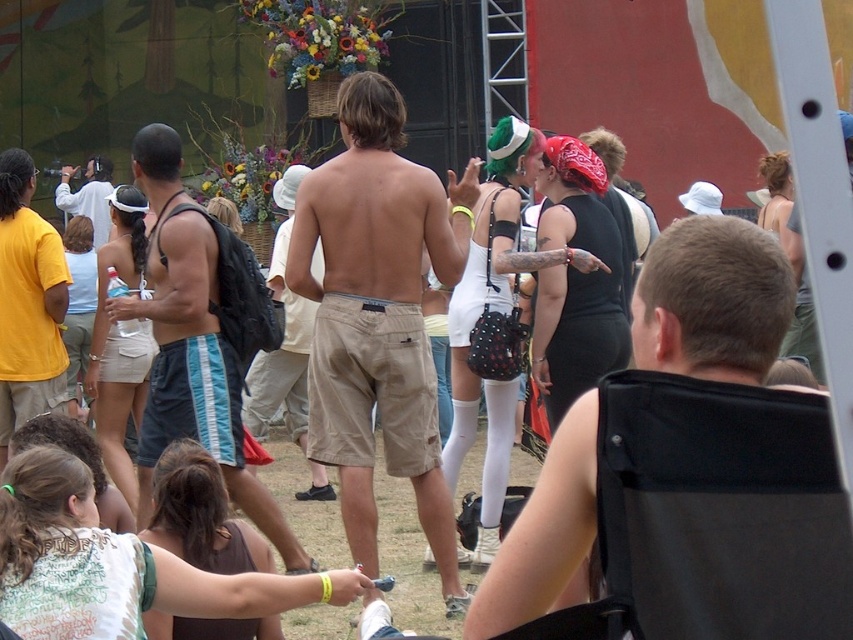
Question: In this image, where is tan cotton shorts at center located relative to blue striped shorts at center?

Choices:
 (A) above
 (B) below

Answer: (A)

Question: Which object is closer to the camera taking this photo?

Choices:
 (A) tan cotton shorts at center
 (B) light brown fabric shorts at center
 (C) yellow cotton t-shirt at left

Answer: (B)

Question: Among these points, which one is farthest from the camera?

Choices:
 (A) (329, 310)
 (B) (193, 221)
 (C) (675, 340)

Answer: (B)

Question: Is blue striped shorts at center to the right of light brown fabric shorts at center from the viewer's perspective?

Choices:
 (A) no
 (B) yes

Answer: (A)

Question: Among these objects, which one is farthest from the camera?

Choices:
 (A) tan cotton shorts at center
 (B) blue striped shorts at center

Answer: (B)

Question: Is blue striped shorts at center positioned in front of light brown fabric shorts at center?

Choices:
 (A) no
 (B) yes

Answer: (A)